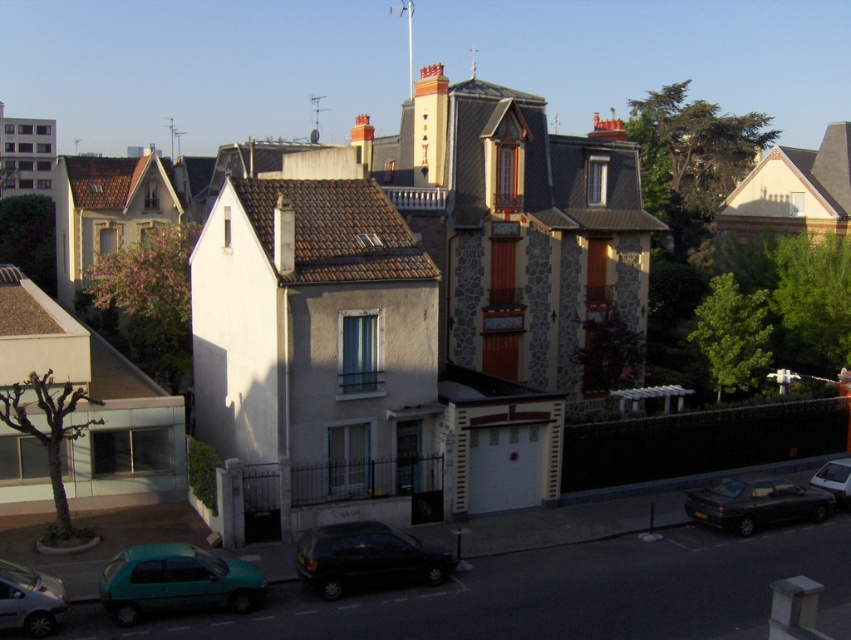
Question: Which of these objects is positioned farthest from the shiny dark gray sedan at lower right?

Choices:
 (A) teal matte hatchback at lower left
 (B) shiny black sedan at lower center
 (C) metallic teal hatchback at lower left

Answer: (C)

Question: Does shiny black sedan at lower center have a lesser width compared to metallic silver sedan at lower right?

Choices:
 (A) no
 (B) yes

Answer: (A)

Question: Is teal matte hatchback at lower left wider than shiny black sedan at lower center?

Choices:
 (A) yes
 (B) no

Answer: (B)

Question: Which of the following is the closest to the observer?

Choices:
 (A) shiny dark gray sedan at lower right
 (B) metallic silver sedan at lower right
 (C) metallic teal hatchback at lower left

Answer: (C)

Question: Does teal matte hatchback at lower left have a greater width compared to shiny black sedan at lower center?

Choices:
 (A) yes
 (B) no

Answer: (B)

Question: Which is farther from the shiny dark gray sedan at lower right?

Choices:
 (A) teal matte hatchback at lower left
 (B) metallic silver sedan at lower right

Answer: (A)